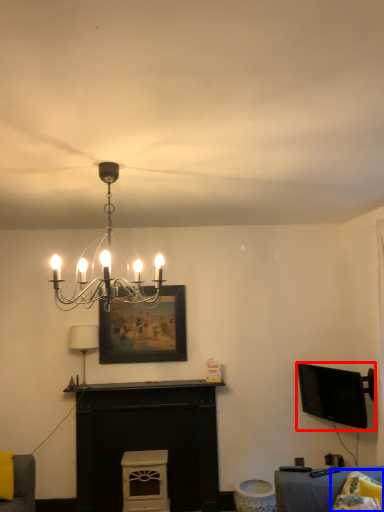
Question: Which object is further to the camera taking this photo, television (highlighted by a red box) or pillow (highlighted by a blue box)?

Choices:
 (A) television
 (B) pillow

Answer: (A)